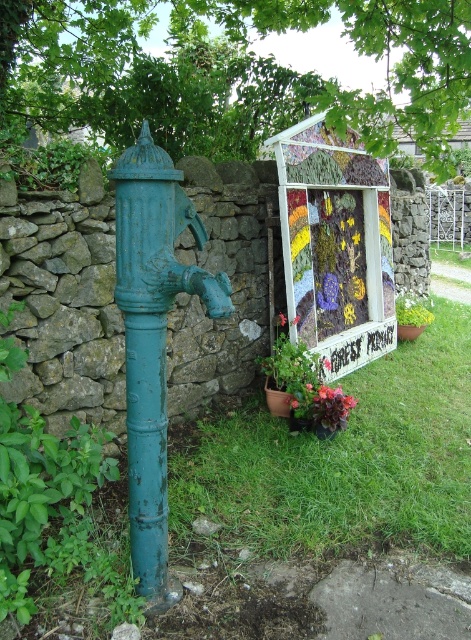
Question: From the image, what is the correct spatial relationship of matte teal pipe at left in relation to matte red flower at center?

Choices:
 (A) below
 (B) above

Answer: (A)

Question: Is green grass at lower center thinner than matte teal pipe at left?

Choices:
 (A) yes
 (B) no

Answer: (B)

Question: Can you confirm if green grass at lower center is positioned above dark red matte flower at center?

Choices:
 (A) yes
 (B) no

Answer: (B)

Question: Which object is positioned closest to the green grass at lower center?

Choices:
 (A) matte red flower at center
 (B) dark red matte flower at center
 (C) matte pink flower at center

Answer: (B)

Question: Which object appears closest to the camera in this image?

Choices:
 (A) matte pink flower at center
 (B) dark red matte flower at center
 (C) matte teal pipe at left

Answer: (C)

Question: Which object appears closest to the camera in this image?

Choices:
 (A) green grass at lower center
 (B) dark red matte flower at center
 (C) matte pink flower at center

Answer: (A)